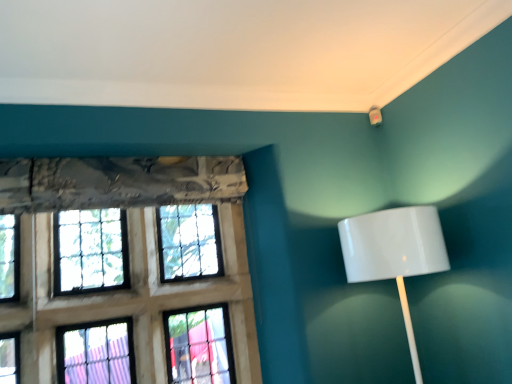
Question: Is point click(x=74, y=273) positioned closer to the camera than point click(x=428, y=218)?

Choices:
 (A) farther
 (B) closer

Answer: (A)

Question: Is stained glass window at left in front of or behind white glossy lampshade at right in the image?

Choices:
 (A) behind
 (B) front

Answer: (A)

Question: From a real-world perspective, is stained glass window at left physically located above or below white glossy lampshade at right?

Choices:
 (A) below
 (B) above

Answer: (B)

Question: Visually, is white glossy lampshade at right positioned to the left or to the right of stained glass window at left?

Choices:
 (A) right
 (B) left

Answer: (A)

Question: Choose the correct answer: Is white glossy lampshade at right inside stained glass window at left or outside it?

Choices:
 (A) outside
 (B) inside

Answer: (A)

Question: In the image, is white glossy lampshade at right positioned in front of or behind stained glass window at left?

Choices:
 (A) front
 (B) behind

Answer: (A)

Question: In terms of size, does white glossy lampshade at right appear bigger or smaller than stained glass window at left?

Choices:
 (A) big
 (B) small

Answer: (B)